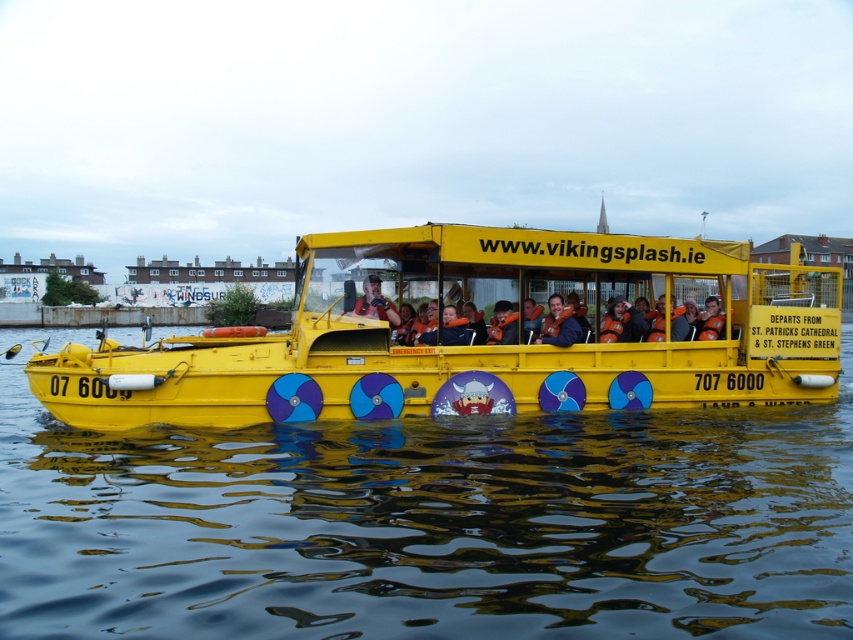
You are a safety inspector checking the equipment on the duck boat. You see the matte orange life vest at center and the matte black helmet at center. Which one is larger in size?

The matte orange life vest at center is bigger than the matte black helmet at center.